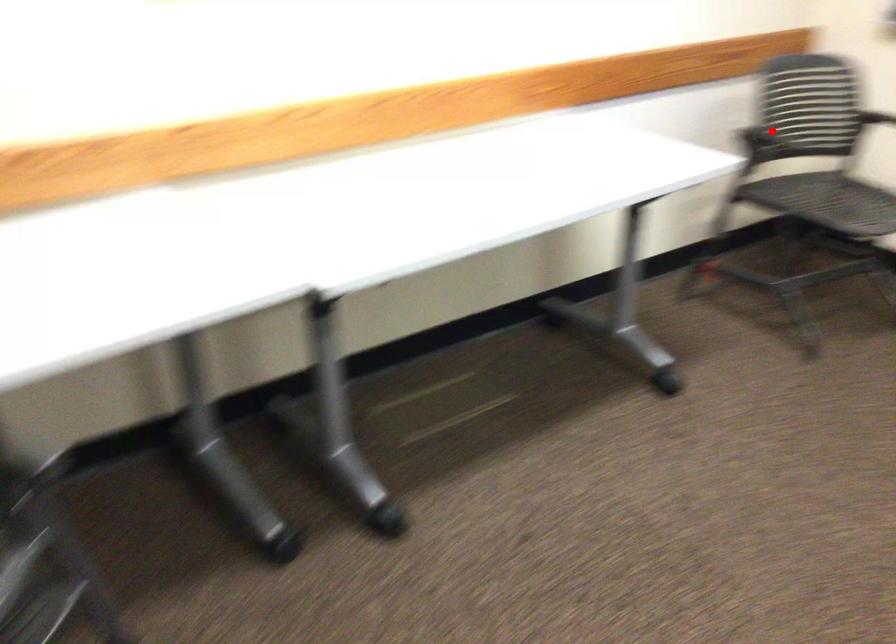
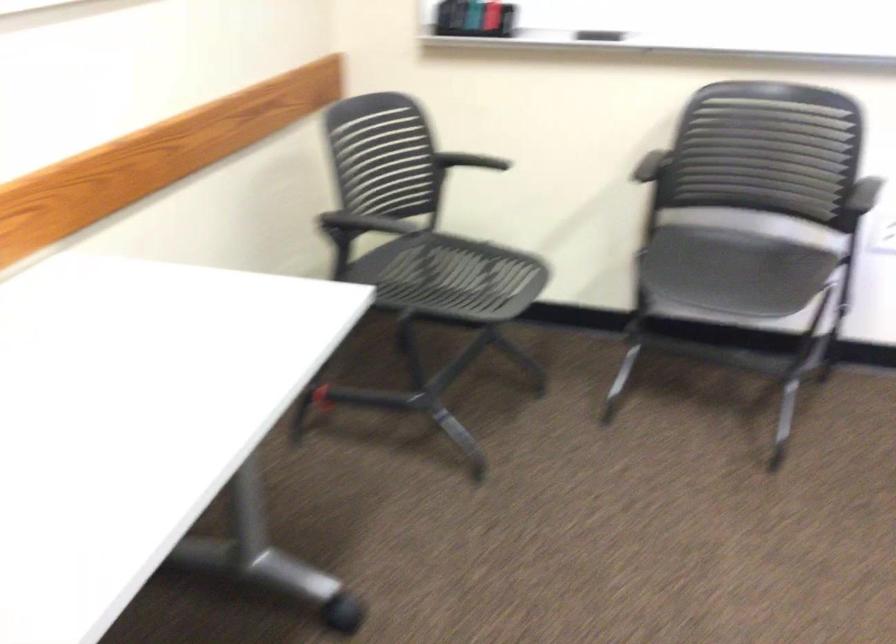
Question: I am providing you with two images of the same scene from different viewpoints. Given a red point in image1, look at the same physical point in image2. Is it:

Choices:
 (A) Closer to the viewpoint
 (B) Farther from the viewpoint

Answer: (A)